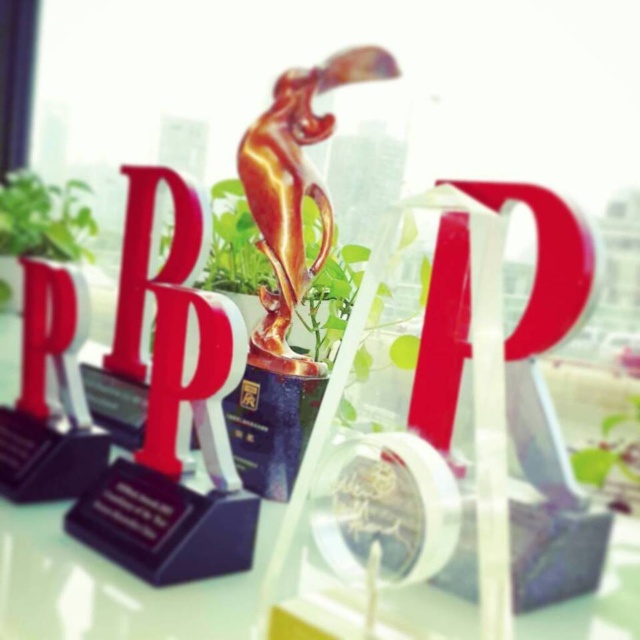
Question: Observing the image, what is the correct spatial positioning of green leafy plant at upper left in reference to green leafy plant at center?

Choices:
 (A) below
 (B) above

Answer: (B)

Question: Estimate the real-world distances between objects in this image. Which object is closer to the red plastic letter b at center?

Choices:
 (A) green leafy plant at upper left
 (B) matte plastic letter p at center right

Answer: (B)

Question: Which is nearer to the green leafy plant at center?

Choices:
 (A) green leafy plant at upper left
 (B) red plastic letter b at center

Answer: (B)

Question: Based on their relative distances, which object is farther from the green leafy plant at center?

Choices:
 (A) green leafy plant at upper left
 (B) matte plastic letter p at center right
 (C) red plastic letter b at center

Answer: (A)

Question: Does matte plastic letter p at center right have a greater width compared to green leafy plant at center?

Choices:
 (A) no
 (B) yes

Answer: (B)

Question: In this image, where is green leafy plant at upper left located relative to green leafy plant at center?

Choices:
 (A) left
 (B) right

Answer: (A)